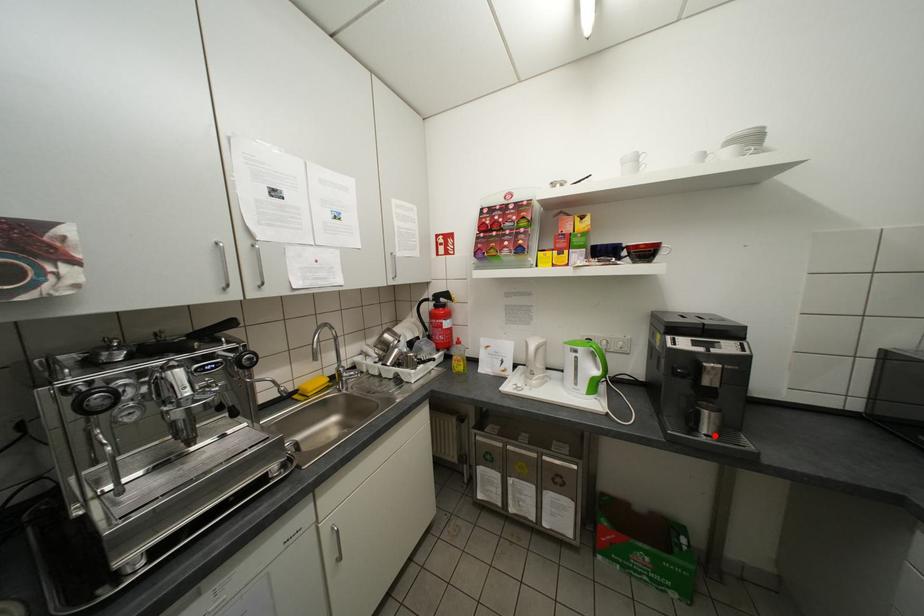
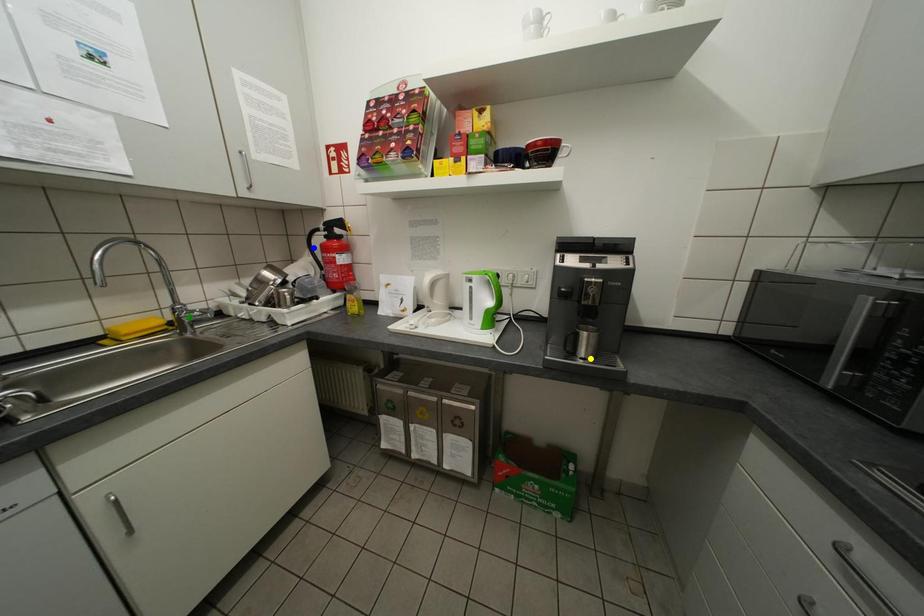
Question: I am providing you with two images of the same scene from different viewpoints. A red point is marked on the first image. You are given multiple points on the second image. Which point in image 2 represents the same 3d spot as the red point in image 1?

Choices:
 (A) green point
 (B) yellow point
 (C) blue point

Answer: (B)